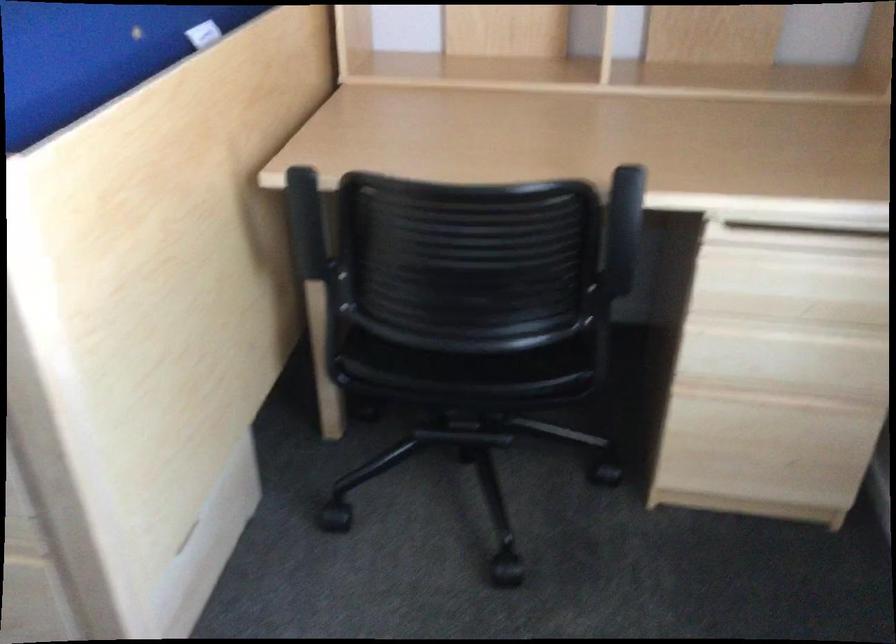
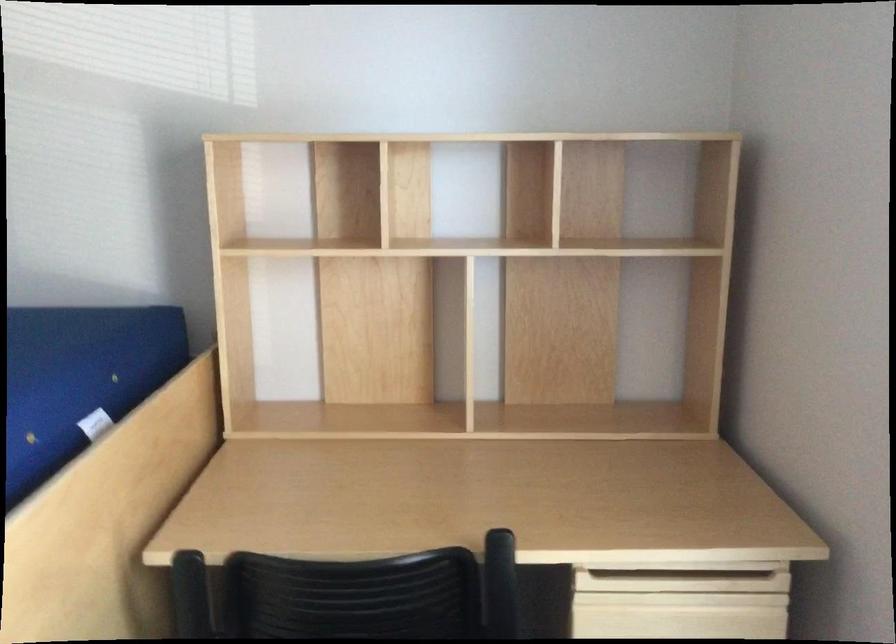
Question: How did the camera likely rotate?

Choices:
 (A) Left
 (B) Right
 (C) Up
 (D) Down

Answer: (C)